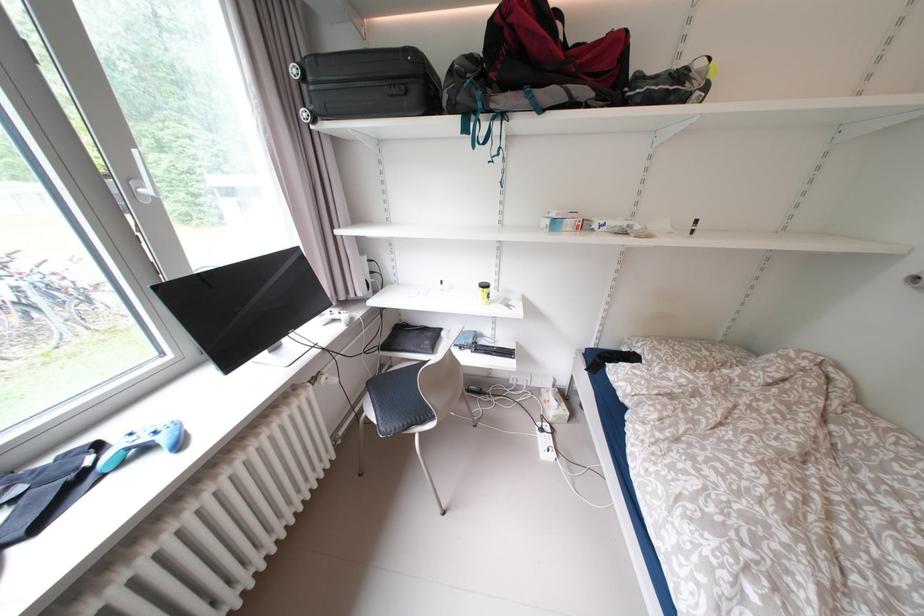
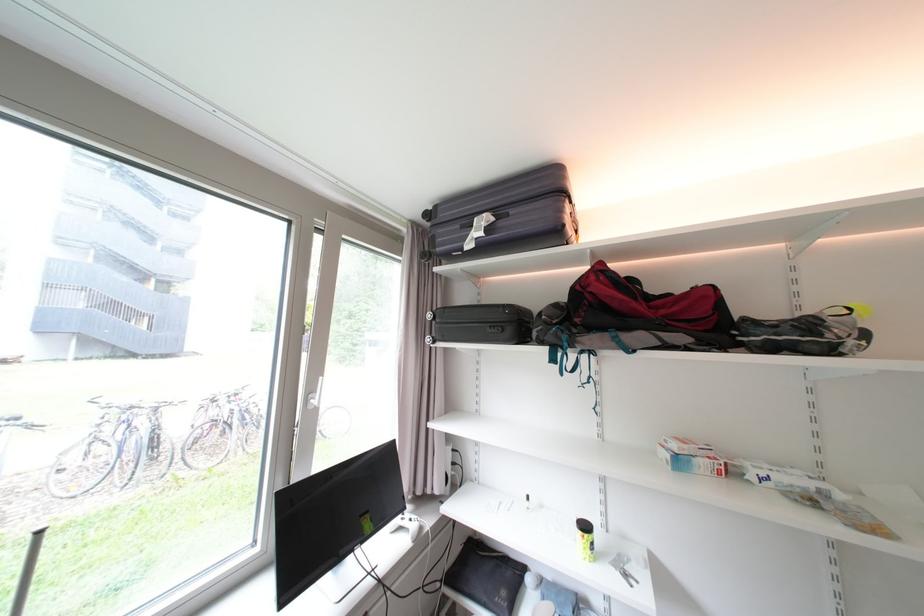
In the second image, find the point that corresponds to the point at 490,290 in the first image.

(589, 533)